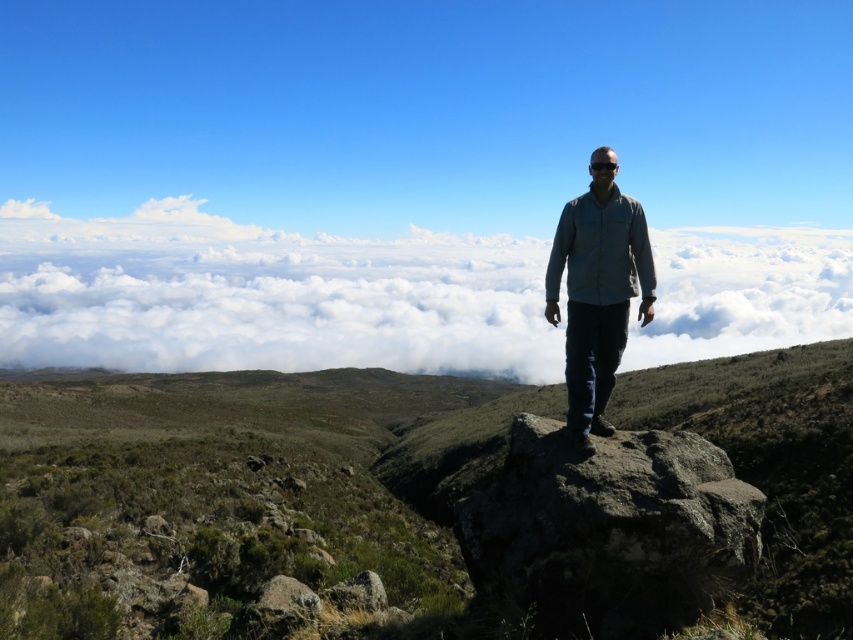
Question: Does smooth gray rock at lower left appear under rough gray rock at center?

Choices:
 (A) yes
 (B) no

Answer: (B)

Question: Among these objects, which one is nearest to the camera?

Choices:
 (A) dark gray rough rock at center
 (B) white fluffy cloud at center
 (C) smooth gray rock at lower left

Answer: (A)

Question: Can you confirm if dark gray rough rock at center is positioned above smooth gray rock at lower left?

Choices:
 (A) yes
 (B) no

Answer: (A)

Question: Among these points, which one is nearest to the camera?

Choices:
 (A) (558, 259)
 (B) (334, 600)

Answer: (A)

Question: Which object appears farthest from the camera in this image?

Choices:
 (A) white fluffy cloud at center
 (B) light gray fabric shirt at center

Answer: (A)

Question: Is dark gray rough rock at center in front of rough gray rock at center?

Choices:
 (A) no
 (B) yes

Answer: (B)